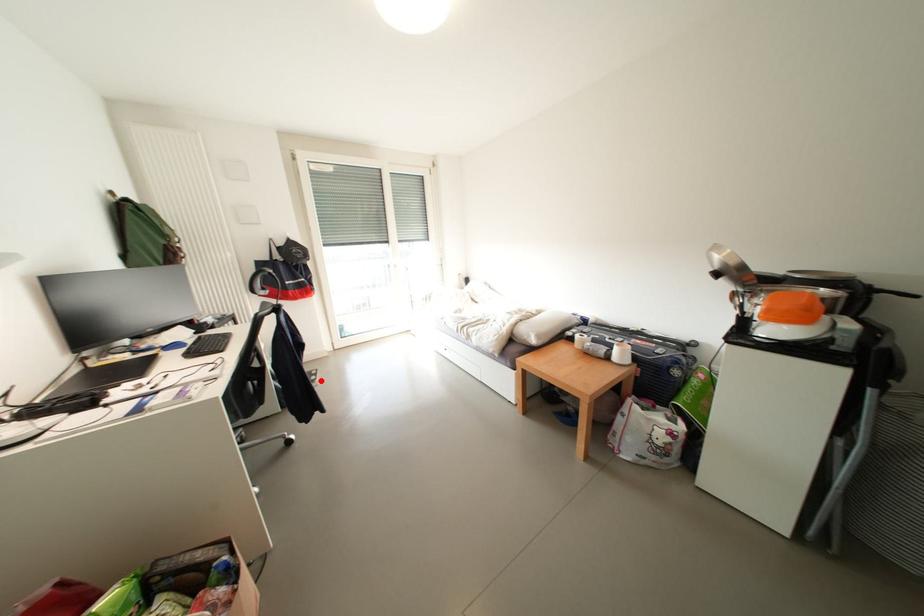
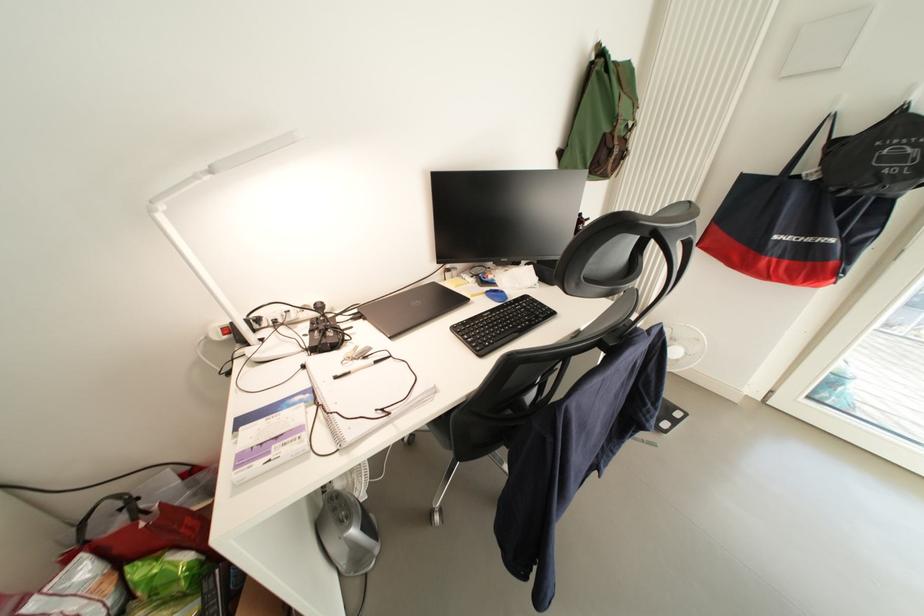
Where in the second image is the point corresponding to the highlighted location from the first image?

(673, 428)